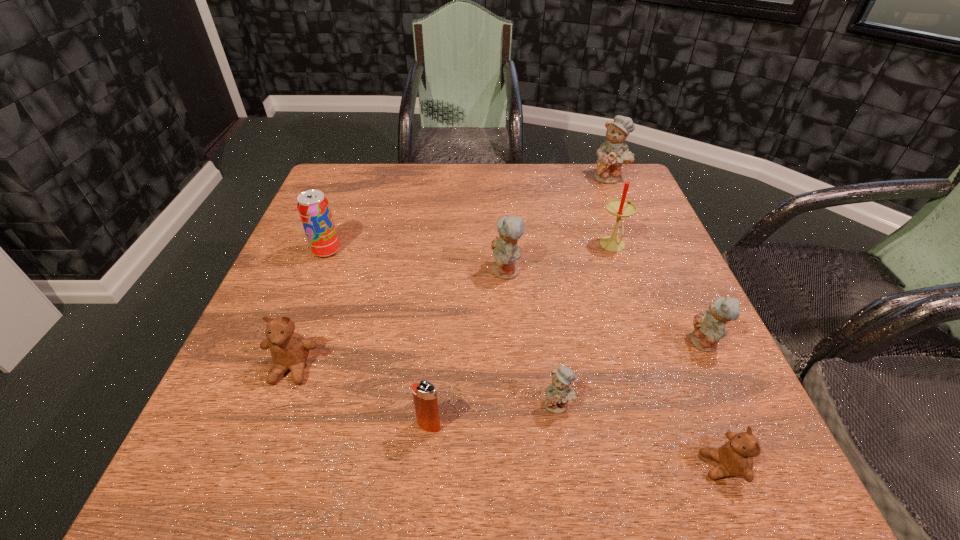
Find the location of a particular element. The width and height of the screenshot is (960, 540). vacant space at the right edge of the desktop is located at coordinates (734, 384).

The image size is (960, 540). In the image, there is a desktop. Identify the location of vacant space at the far right corner. (612, 185).

At what (x,y) coordinates should I click in order to perform the action: click on free space between the farther brown teddy bear and the third biggest blue teddy bear. Please return your answer as a coordinate pair (x, y). The image size is (960, 540). Looking at the image, I should click on (498, 356).

In order to click on vacant space in between the second blue teddy bear from left to right and the nearer brown teddy bear in this screenshot , I will do pyautogui.click(x=639, y=435).

Image resolution: width=960 pixels, height=540 pixels. What are the coordinates of `free point between the second smallest blue teddy bear and the biggest blue teddy bear` in the screenshot? It's located at (657, 260).

The height and width of the screenshot is (540, 960). In order to click on vacant space that's between the leftmost teddy bear and the candle in this screenshot , I will do `click(452, 308)`.

Locate an element on the screen. free space between the second biggest blue teddy bear and the second nearest blue teddy bear is located at coordinates (605, 307).

This screenshot has height=540, width=960. I want to click on empty space that is in between the second smallest blue teddy bear and the soda can, so click(x=516, y=297).

I want to click on vacant area that lies between the candle and the nearer brown teddy bear, so click(x=667, y=356).

Identify the location of blank region between the nearest blue teddy bear and the igniter. Image resolution: width=960 pixels, height=540 pixels. (493, 415).